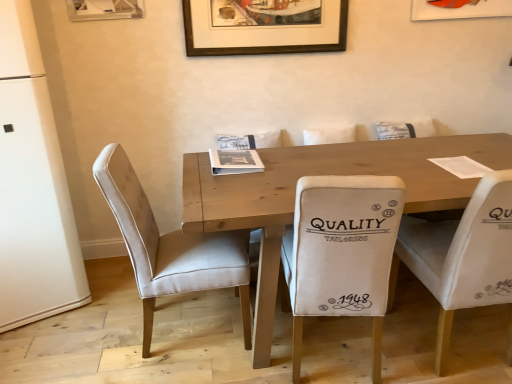
Identify the location of free point to the left of beige velvet chair at left, which is the first chair from left to right. This screenshot has height=384, width=512. (90, 336).